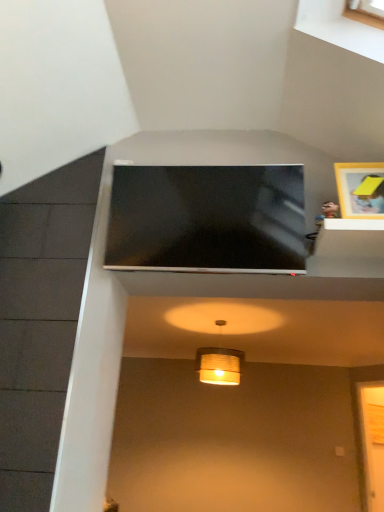
This screenshot has height=512, width=384. Find the location of `matte black tv at upper center`. matte black tv at upper center is located at coordinates (207, 219).

What do you see at coordinates (360, 189) in the screenshot? I see `wooden picture frame at upper right` at bounding box center [360, 189].

Find the location of a particular element. This screenshot has width=384, height=512. matte yellow paper lampshade at center is located at coordinates (219, 365).

From the image's perspective, which is below, matte black tv at upper center or transparent glass door at lower right?

From the image's view, transparent glass door at lower right is below.

Is matte black tv at upper center located outside transparent glass door at lower right?

Indeed, matte black tv at upper center is completely outside transparent glass door at lower right.

Is matte black tv at upper center touching transparent glass door at lower right?

matte black tv at upper center and transparent glass door at lower right are clearly separated.

Considering the positions of point (232, 366) and point (235, 214), is point (232, 366) closer or farther from the camera than point (235, 214)?

Point (232, 366).

Where is `television in front of the matte yellow paper lampshade at center`? television in front of the matte yellow paper lampshade at center is located at coordinates (207, 219).

Relative to matte black tv at upper center, is matte yellow paper lampshade at center in front or behind?

Clearly, matte yellow paper lampshade at center is behind matte black tv at upper center.

Which point is more forward, (x=342, y=187) or (x=378, y=444)?

The point (x=342, y=187) is more forward.

Between wooden picture frame at upper right and transparent glass door at lower right, which one has more height?

transparent glass door at lower right is taller.

From a real-world perspective, is wooden picture frame at upper right physically above transparent glass door at lower right?

Yes, from a real-world perspective, wooden picture frame at upper right is on top of transparent glass door at lower right.

Is wooden picture frame at upper right to the left or to the right of transparent glass door at lower right in the image?

In the image, wooden picture frame at upper right appears on the left side of transparent glass door at lower right.

Does matte yellow paper lampshade at center come in front of transparent glass door at lower right?

Yes.

Looking at this image, considering the sizes of matte yellow paper lampshade at center and transparent glass door at lower right in the image, is matte yellow paper lampshade at center taller or shorter than transparent glass door at lower right?

In the image, matte yellow paper lampshade at center appears to be shorter than transparent glass door at lower right.

Is matte yellow paper lampshade at center aimed at transparent glass door at lower right?

No, matte yellow paper lampshade at center is not turned towards transparent glass door at lower right.

From the image's perspective, is matte yellow paper lampshade at center on transparent glass door at lower right?

Yes.

Is matte black tv at upper center next to wooden picture frame at upper right?

matte black tv at upper center is not next to wooden picture frame at upper right, and they're not touching.

Is matte black tv at upper center facing towards wooden picture frame at upper right?

No, matte black tv at upper center does not turn towards wooden picture frame at upper right.

What's the angular difference between matte black tv at upper center and wooden picture frame at upper right's facing directions?

There is a 0.344-degree angle between the facing directions of matte black tv at upper center and wooden picture frame at upper right.

Is wooden picture frame at upper right surrounded by matte black tv at upper center?

No, wooden picture frame at upper right is located outside of matte black tv at upper center.

From the picture: From a real-world perspective, which is physically below, matte black tv at upper center or matte yellow paper lampshade at center?

From a 3D spatial view, matte yellow paper lampshade at center is below.

Is point (188, 247) closer or farther from the camera than point (214, 366)?

Point (188, 247) is closer to the camera than point (214, 366).

Looking at this image, from the image's perspective, would you say matte black tv at upper center is shown under matte yellow paper lampshade at center?

No, from the image's perspective, matte black tv at upper center is not below matte yellow paper lampshade at center.

Consider the image. Does matte black tv at upper center touch matte yellow paper lampshade at center?

No, matte black tv at upper center is not beside matte yellow paper lampshade at center.

How far apart are transparent glass door at lower right and wooden picture frame at upper right?

transparent glass door at lower right and wooden picture frame at upper right are 3.39 meters apart.

Which is correct: transparent glass door at lower right is inside wooden picture frame at upper right, or outside of it?

The correct answer is: outside.

Between transparent glass door at lower right and wooden picture frame at upper right, which one is positioned behind?

transparent glass door at lower right is behind.

Is transparent glass door at lower right facing away from wooden picture frame at upper right?

That's not correct — transparent glass door at lower right is not looking away from wooden picture frame at upper right.

Locate an element on the screen. This screenshot has width=384, height=512. television located on the left of transparent glass door at lower right is located at coordinates (207, 219).

Locate an element on the screen. lamp on the right of matte black tv at upper center is located at coordinates (219, 365).

Considering their positions, is wooden picture frame at upper right positioned further to matte yellow paper lampshade at center than transparent glass door at lower right?

wooden picture frame at upper right is positioned further to the anchor matte yellow paper lampshade at center.

From the image, which object appears to be nearer to transparent glass door at lower right, matte black tv at upper center or matte yellow paper lampshade at center?

matte yellow paper lampshade at center lies closer to transparent glass door at lower right than the other object.

Estimate the real-world distances between objects in this image. Which object is closer to matte black tv at upper center, matte yellow paper lampshade at center or wooden picture frame at upper right?

wooden picture frame at upper right is positioned closer to the anchor matte black tv at upper center.

Looking at the image, which one is located closer to wooden picture frame at upper right, matte black tv at upper center or matte yellow paper lampshade at center?

Among the two, matte black tv at upper center is located nearer to wooden picture frame at upper right.

Which object lies further to the anchor point matte yellow paper lampshade at center, transparent glass door at lower right or wooden picture frame at upper right?

Based on the image, wooden picture frame at upper right appears to be further to matte yellow paper lampshade at center.

Which object lies nearer to the anchor point wooden picture frame at upper right, matte yellow paper lampshade at center or transparent glass door at lower right?

matte yellow paper lampshade at center.

Estimate the real-world distances between objects in this image. Which object is closer to matte yellow paper lampshade at center, transparent glass door at lower right or matte black tv at upper center?

transparent glass door at lower right lies closer to matte yellow paper lampshade at center than the other object.

From the image, which object appears to be farther from transparent glass door at lower right, matte black tv at upper center or wooden picture frame at upper right?

Based on the image, matte black tv at upper center appears to be further to transparent glass door at lower right.

In order to click on television located between wooden picture frame at upper right and transparent glass door at lower right in the depth direction in this screenshot , I will do (207, 219).

Identify the location of lamp between wooden picture frame at upper right and transparent glass door at lower right in the front-back direction. 219,365.

The width and height of the screenshot is (384, 512). Identify the location of lamp located between matte black tv at upper center and transparent glass door at lower right in the depth direction. (219, 365).

Identify the location of television between wooden picture frame at upper right and matte yellow paper lampshade at center along the z-axis. (207, 219).